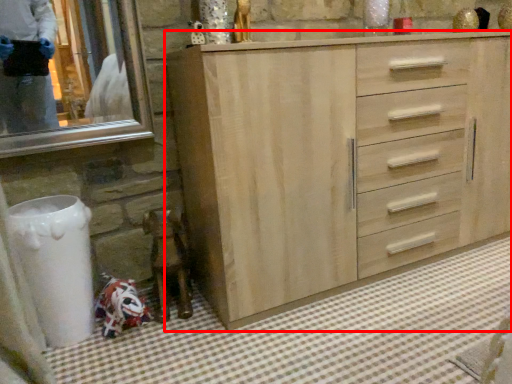
Question: In this image, where is chest of drawers (annotated by the red box) located relative to bath mat?

Choices:
 (A) left
 (B) right

Answer: (B)